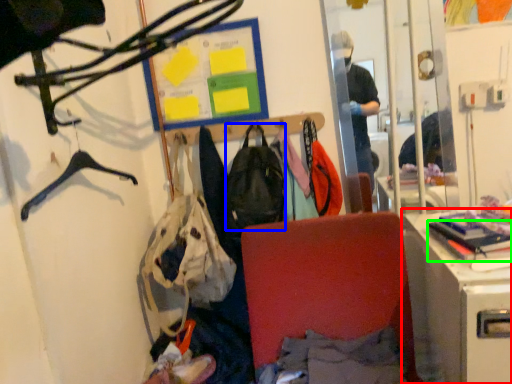
Question: Based on their relative distances, which object is farther from desk (highlighted by a red box)? Choose from backpack (highlighted by a blue box) and book (highlighted by a green box).

Choices:
 (A) backpack
 (B) book

Answer: (A)